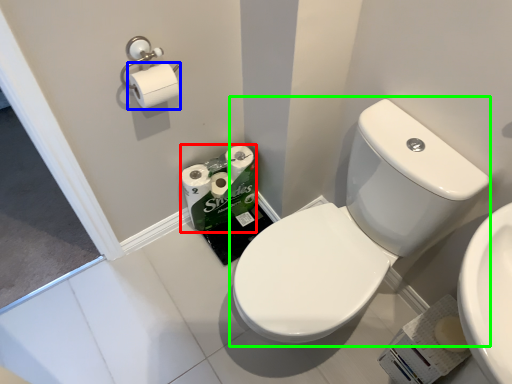
Question: Which is farther away from toilet paper (highlighted by a red box)? toilet paper (highlighted by a blue box) or sink (highlighted by a green box)?

Choices:
 (A) toilet paper
 (B) sink

Answer: (B)